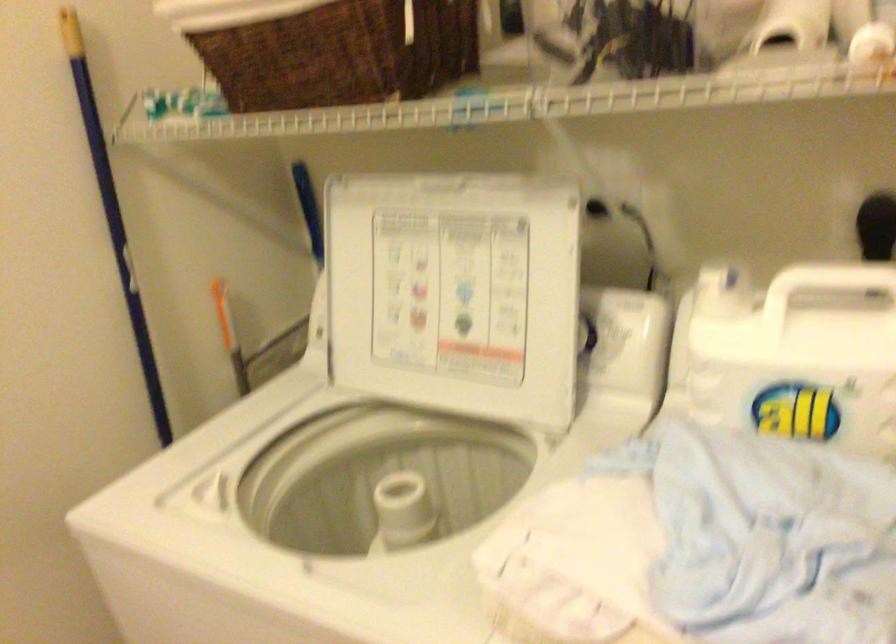
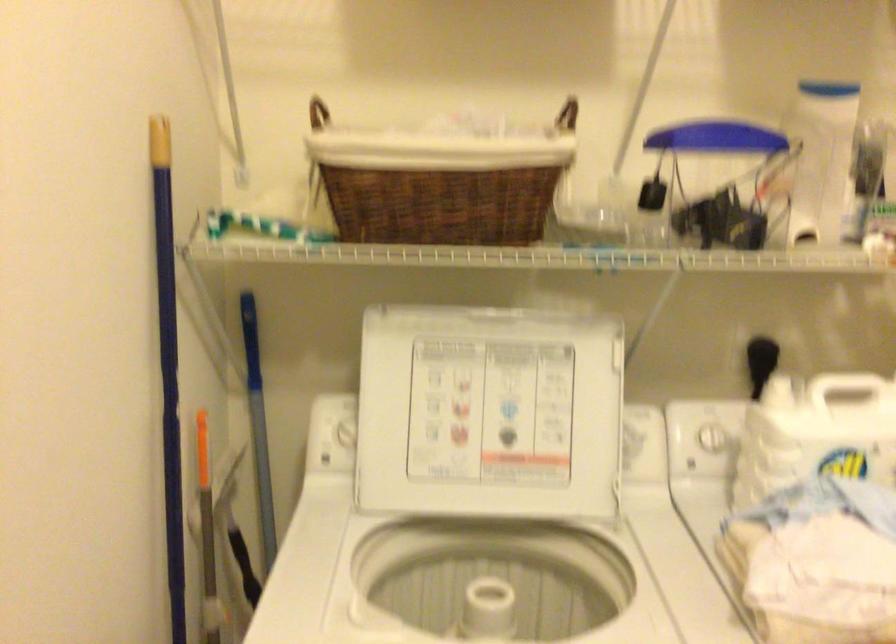
Locate, in the second image, the point that corresponds to [704,341] in the first image.

(698, 440)